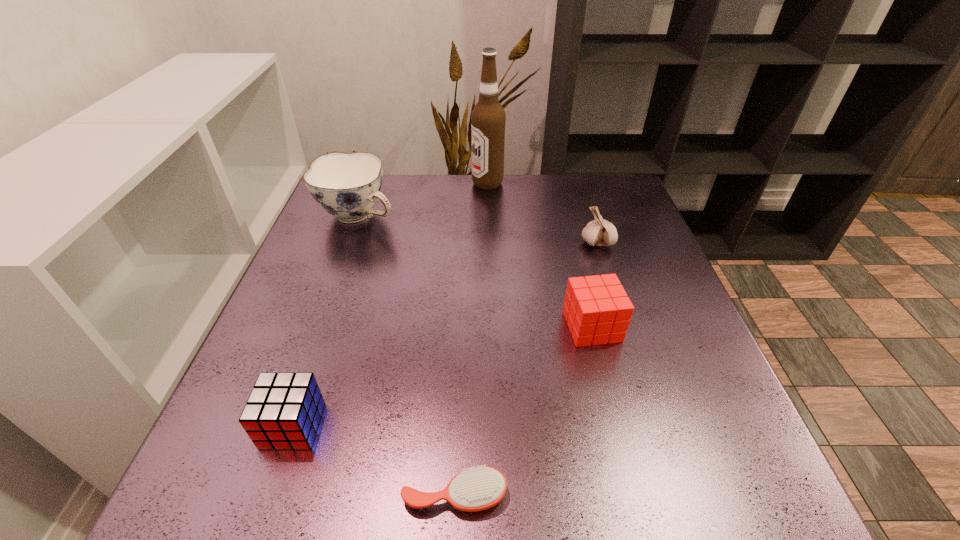
Locate an element on the screen. alcohol is located at coordinates (488, 118).

In order to click on the tallest object in this screenshot , I will do `click(488, 118)`.

Identify the location of the second tallest object. (347, 186).

Where is `garlic`? This screenshot has height=540, width=960. garlic is located at coordinates (599, 232).

Where is `the farther cube`? the farther cube is located at coordinates (597, 310).

You are a GUI agent. You are given a task and a screenshot of the screen. Output one action in this format:
    pyautogui.click(x=<x>, y=<y>)
    Task: Click on the right cube
    The image size is (960, 540).
    Given the screenshot: What is the action you would take?
    pyautogui.click(x=597, y=310)

This screenshot has height=540, width=960. Find the location of `the left cube`. the left cube is located at coordinates (283, 411).

The height and width of the screenshot is (540, 960). Identify the location of the fifth farthest object. (283, 411).

Identify the location of the nearest object. This screenshot has height=540, width=960. (479, 488).

Image resolution: width=960 pixels, height=540 pixels. In order to click on hairbrush in this screenshot , I will do `click(479, 488)`.